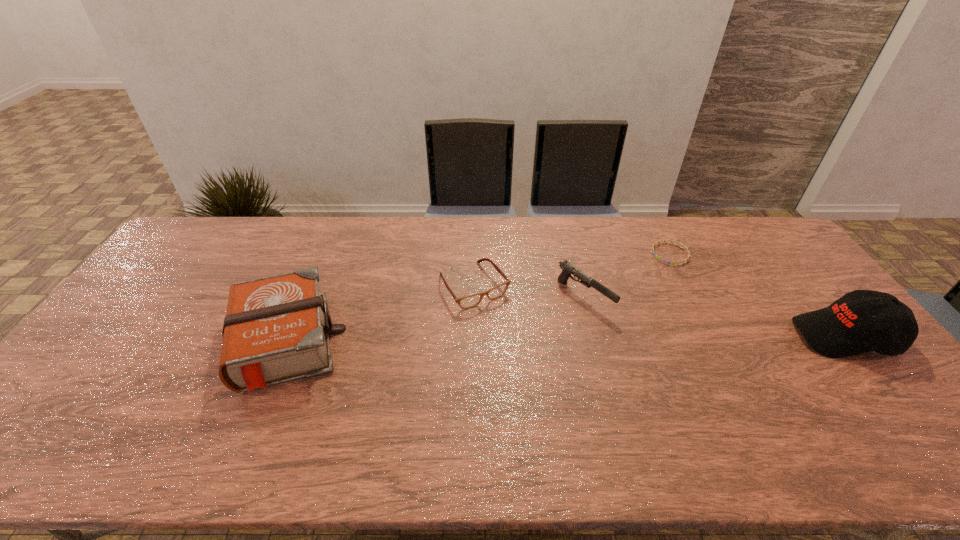
Locate an element on the screen. Image resolution: width=960 pixels, height=540 pixels. vacant space in between the spectacles and the Bible is located at coordinates (379, 314).

You are a GUI agent. You are given a task and a screenshot of the screen. Output one action in this format:
    pyautogui.click(x=<x>, y=<y>)
    Task: Click on the empty location between the second shortest object and the leftmost object
    The image size is (960, 540).
    Given the screenshot: What is the action you would take?
    pyautogui.click(x=379, y=314)

At what (x,y) coordinates should I click in order to perform the action: click on empty space that is in between the spectacles and the third tallest object. Please return your answer as a coordinate pair (x, y). Looking at the image, I should click on (529, 292).

This screenshot has width=960, height=540. What are the coordinates of `free space between the third tallest object and the baseball cap` in the screenshot? It's located at (714, 316).

Find the location of `free spot between the Bible and the third tallest object`. free spot between the Bible and the third tallest object is located at coordinates (434, 320).

Where is `free space between the baseball cap and the fourth object from left to right`? Image resolution: width=960 pixels, height=540 pixels. free space between the baseball cap and the fourth object from left to right is located at coordinates (757, 295).

Identify which object is the nearest to the baseball cap. Please provide its 2D coordinates. Your answer should be formatted as a tuple, i.e. [(x, y)], where the tuple contains the x and y coordinates of a point satisfying the conditions above.

[(652, 248)]

This screenshot has width=960, height=540. Identify the location of object that is the closest to the shortest object. (567, 269).

Where is `free spot that satisfies the following two spatial constraints: 1. on the front side of the rightmost object; 2. on the front-facing side of the third object from right to left`? The height and width of the screenshot is (540, 960). free spot that satisfies the following two spatial constraints: 1. on the front side of the rightmost object; 2. on the front-facing side of the third object from right to left is located at coordinates (594, 336).

Locate an element on the screen. vacant area that satisfies the following two spatial constraints: 1. on the front side of the third tallest object; 2. on the front-facing side of the baseball cap is located at coordinates (594, 336).